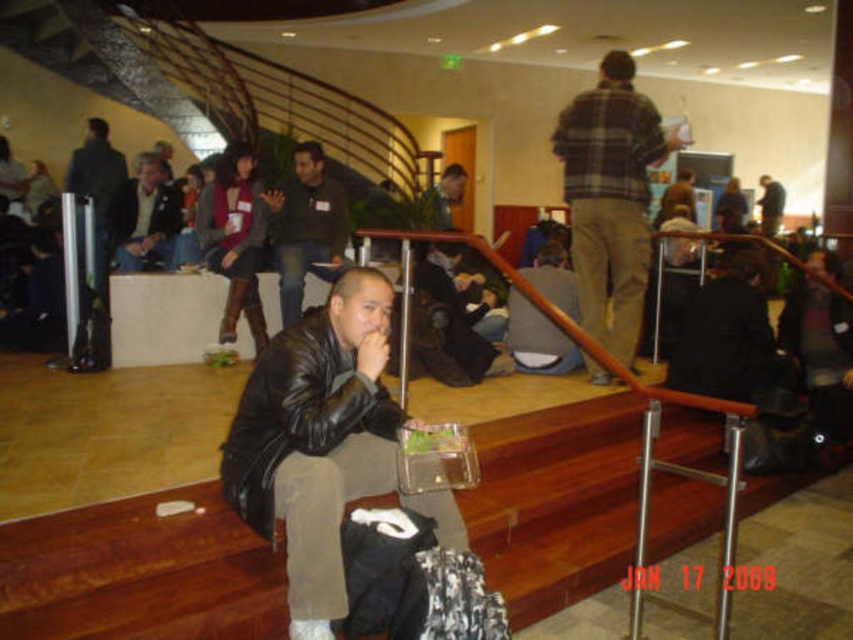
You are standing at the base of the staircase and want to reach the light brown leather jacket at upper left without passing through the leather jacket at center. Is there enough space between them to navigate around?

The leather jacket at center is 3.45 meters away from the light brown leather jacket at upper left, so there is sufficient space to navigate around the leather jacket at center and reach the light brown leather jacket at upper left without passing through it.

Consider the image. You are standing at the entrance of the lobby and want to locate the dark gray sweater at center. According to the coordinates provided, in which direction should you look to find it?

You should look towards the center of the image, as the dark gray sweater at center is located at coordinates point (306, 227), which corresponds to the central area.

Consider the image. You are standing at the bottom of the staircase and want to see the person in the leather jacket at center. Is there any obstruction between you and the light brown leather jacket at upper left?

The leather jacket at center is in front of the light brown leather jacket at upper left, so the leather jacket at center would obstruct your view of the light brown leather jacket at upper left.